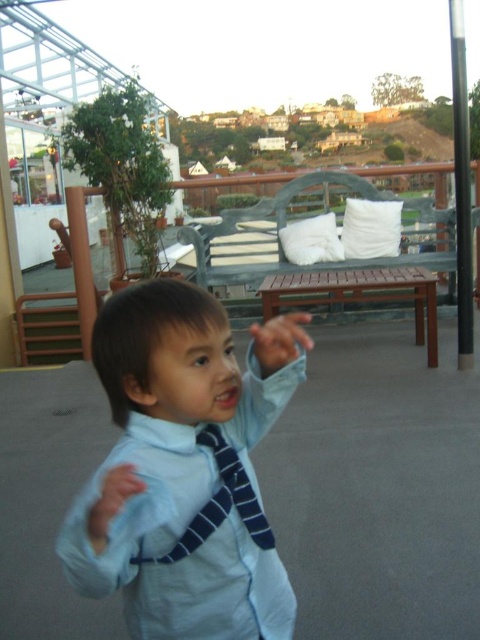
Question: Can you confirm if light blue shirt at center is bigger than blue striped tie at center?

Choices:
 (A) no
 (B) yes

Answer: (B)

Question: Among these objects, which one is nearest to the camera?

Choices:
 (A) smooth skin hand at center
 (B) blue striped tie at center
 (C) light blue shirt at center

Answer: (C)

Question: Among these objects, which one is farthest from the camera?

Choices:
 (A) light blue shirt at center
 (B) blue striped tie at center
 (C) matte blue tie at center

Answer: (B)

Question: Which of the following is the closest to the observer?

Choices:
 (A) (94, 538)
 (B) (141, 513)
 (C) (275, 364)
 (D) (208, 433)

Answer: (A)

Question: Can you confirm if light blue shirt at center is thinner than smooth skin hand at center?

Choices:
 (A) no
 (B) yes

Answer: (A)

Question: Is blue striped tie at center wider than matte blue tie at center?

Choices:
 (A) yes
 (B) no

Answer: (A)